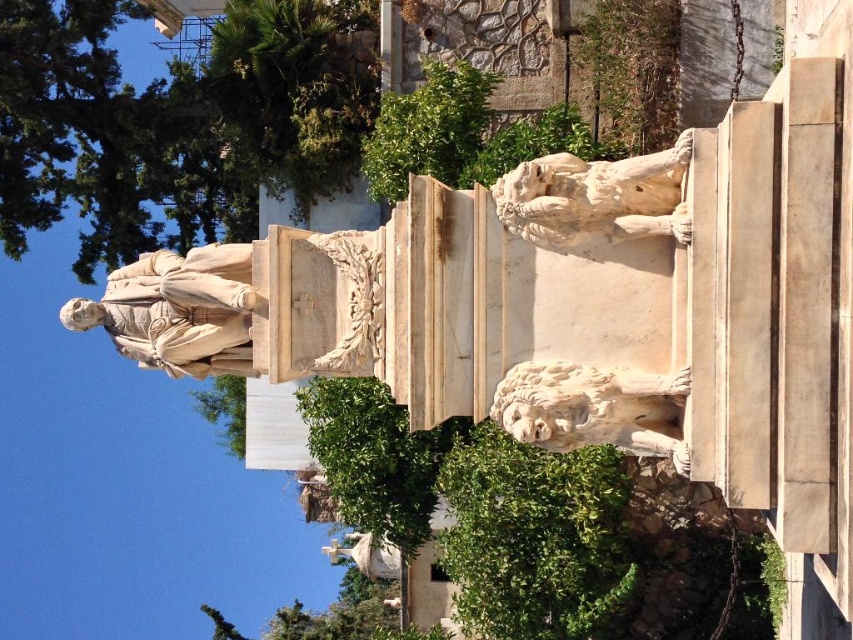
Who is positioned more to the right, white marble statue at center or white marble lion at upper right?

white marble lion at upper right

Between white marble statue at center and white marble lion at upper right, which one has less height?

white marble lion at upper right

Who is more distant from viewer, (210,314) or (585,228)?

The point (210,314) is behind.

Identify the location of white marble statue at center. (178, 310).

Between green leafy bush at lower center and white marble statue at center, which one is positioned lower?

green leafy bush at lower center is below.

Identify the location of green leafy bush at lower center. (535, 538).

This screenshot has height=640, width=853. What do you see at coordinates (535, 538) in the screenshot?
I see `green leafy bush at lower center` at bounding box center [535, 538].

Which is above, green leafy bush at lower center or white marble lion at right?

white marble lion at right is higher up.

Who is more forward, (459, 486) or (521, 410)?

Point (521, 410)

Find the location of `green leafy bush at lower center`. green leafy bush at lower center is located at coordinates (535, 538).